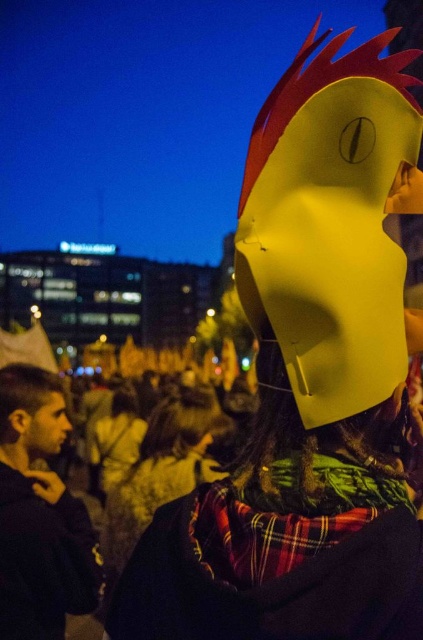
You are a photographer at the event and want to capture a closeup of the matte yellow helmet at center and the smooth skin face at lower left in the same frame. Considering their sizes, which object would appear bigger in the photo?

The matte yellow helmet at center would appear bigger in the photo because its width is larger than the smooth skin face at lower left.

You are a photographer trying to capture the person in the foreground. You notice the matte black hair at lower left and smooth skin face at lower left. Which of these two features is wider when viewed from your camera angle?

The matte black hair at lower left is wider than the smooth skin face at lower left.

You are an event planner trying to set up a camera to capture the rooster mask in the scene. The camera can only focus on objects within a 0.1 unit radius around the point specified. Is the matte yellow mask at upper center within the camera focus area if the camera is set to focus at point (162, 467)?

The matte yellow mask at upper center is located exactly at point (162, 467), so it will be within the camera focus area since the focus is set to that exact point.